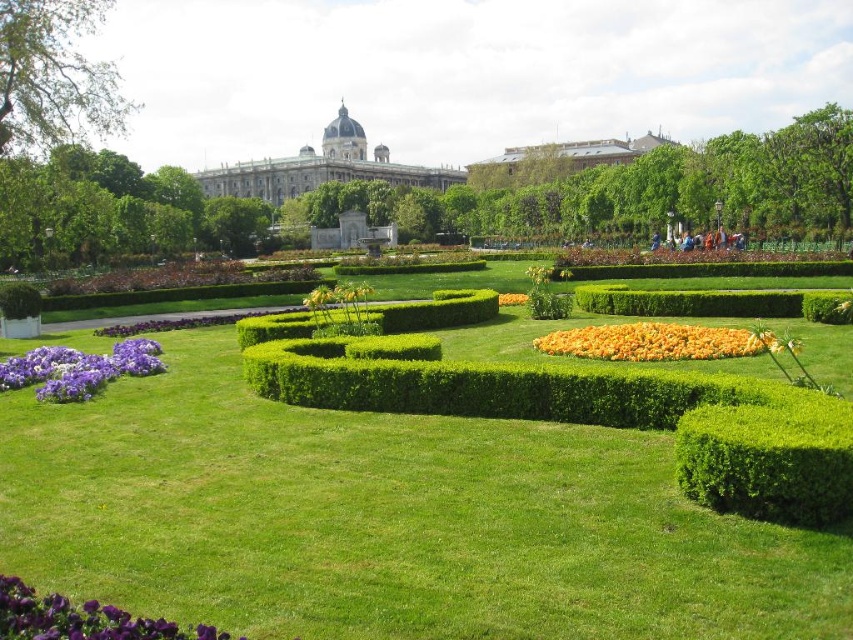
Question: Does gray stone palace at upper center have a smaller size compared to yellow/yellowish-green/yellow-green/yellowish/green/yellow-green/yellow/green/yellow-green/yellow/green/yellow-green/yellow/green/yellow-green/yellow/green/yellow-green/yellow/green/yellow-green/yellow/green/yellow-green/yellow/green/yellow-green/yellow/green/yellow-green/yellow/green/yellow-green/yellow/green/yellow-green/yellow/green/yellow-green/yellow/green/yellow-green/yellow/green/yellow-green/yellow/green/yellow-green/yellow/green/yellow-green/yellow/green/yellow-green?

Choices:
 (A) no
 (B) yes

Answer: (A)

Question: Considering the relative positions of yellow/yellowish-green/yellow-green/yellowish/green/yellow-green/yellow/green/yellow-green/yellow/green/yellow-green/yellow/green/yellow-green/yellow/green/yellow-green/yellow/green/yellow-green/yellow/green/yellow-green/yellow/green/yellow-green/yellow/green/yellow-green/yellow/green/yellow-green/yellow/green/yellow-green/yellow/green/yellow-green/yellow/green/yellow-green/yellow/green/yellow-green/yellow/green/yellow-green/yellow/green/yellow-green/yellow/green/yellow-green and purple matte flower at lower left in the image provided, where is yellow/yellowish-green/yellow-green/yellowish/green/yellow-green/yellow/green/yellow-green/yellow/green/yellow-green/yellow/green/yellow-green/yellow/green/yellow-green/yellow/green/yellow-green/yellow/green/yellow-green/yellow/green/yellow-green/yellow/green/yellow-green/yellow/green/yellow-green/yellow/green/yellow-green/yellow/green/yellow-green/yellow/green/yellow-green/yellow/green/yellow-green/yellow/green/yellow-green/yellow/green/yellow-green/yellow/green/yellow-green located with respect to purple matte flower at lower left?

Choices:
 (A) right
 (B) left

Answer: (A)

Question: Among these objects, which one is farthest from the camera?

Choices:
 (A) green leafy hedge at lower right
 (B) yellow/yellowish-green/yellow-green/yellowish/green/yellow-green/yellow/green/yellow-green/yellow/green/yellow-green/yellow/green/yellow-green/yellow/green/yellow-green/yellow/green/yellow-green/yellow/green/yellow-green/yellow/green/yellow-green/yellow/green/yellow-green/yellow/green/yellow-green/yellow/green/yellow-green/yellow/green/yellow-green/yellow/green/yellow-green/yellow/green/yellow-green/yellow/green/yellow-green/yellow/green/yellow-green/yellow/green/yellow-green
 (C) gray stone palace at upper center

Answer: (C)

Question: Which point is farther from the camera taking this photo?

Choices:
 (A) (840, 515)
 (B) (579, 307)
 (C) (33, 609)
 (D) (346, 138)

Answer: (D)

Question: Does green leafy hedge at lower right have a lesser width compared to gray stone palace at upper center?

Choices:
 (A) yes
 (B) no

Answer: (A)

Question: Estimate the real-world distances between objects in this image. Which object is farther from the green leafy hedge at center?

Choices:
 (A) purple matte flower at lower left
 (B) gray stone palace at upper center
 (C) yellow/yellowish-green/yellow-green/yellowish/green/yellow-green/yellow/green/yellow-green/yellow/green/yellow-green/yellow/green/yellow-green/yellow/green/yellow-green/yellow/green/yellow-green/yellow/green/yellow-green/yellow/green/yellow-green/yellow/green/yellow-green/yellow/green/yellow-green/yellow/green/yellow-green/yellow/green/yellow-green/yellow/green/yellow-green/yellow/green/yellow-green/yellow/green/yellow-green/yellow/green/yellow-green/yellow/green/yellow-green

Answer: (B)